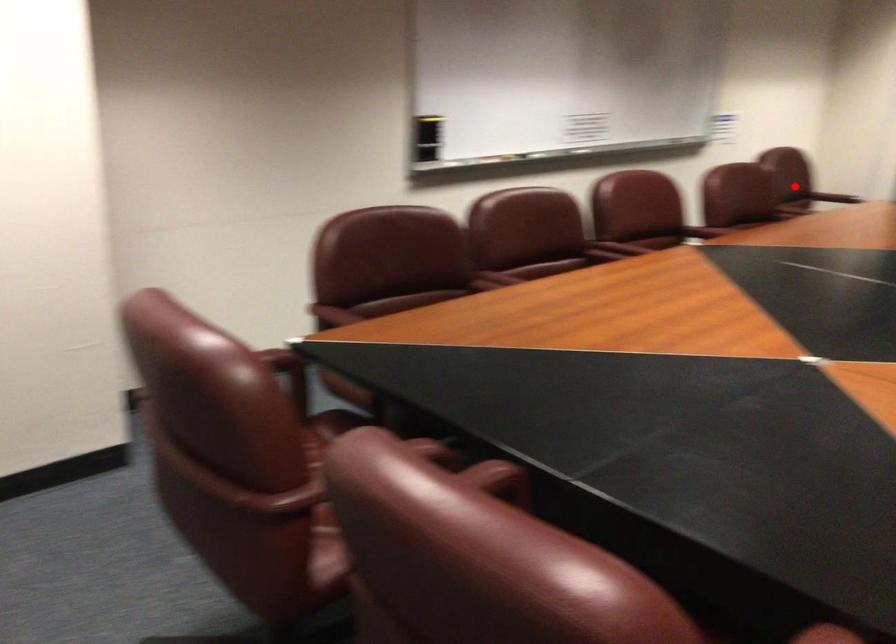
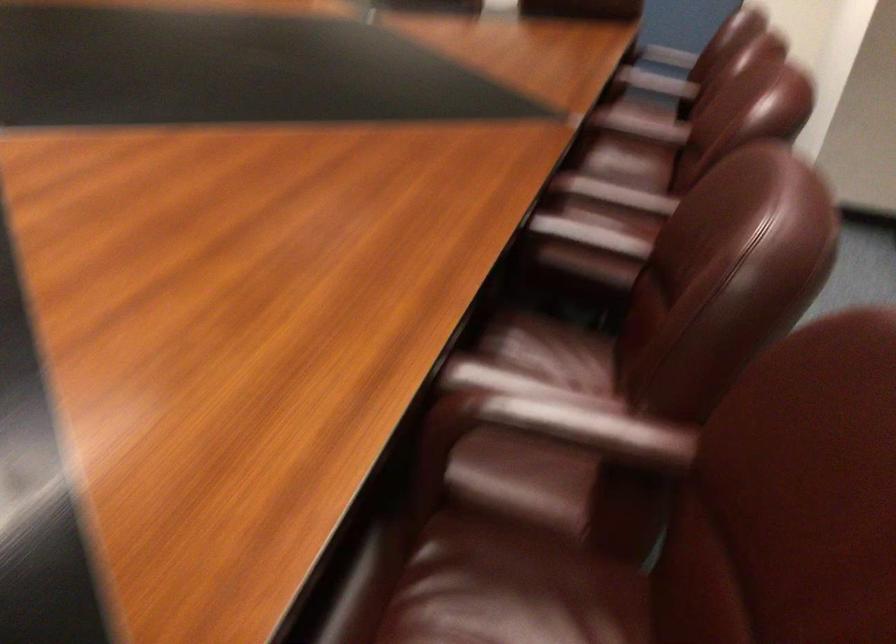
Question: A red point is marked in image1. In image2, is the corresponding 3D point closer to the camera or farther? Reply with the corresponding letter.

Choices:
 (A) The corresponding 3D point is closer.
 (B) The corresponding 3D point is farther.

Answer: (A)